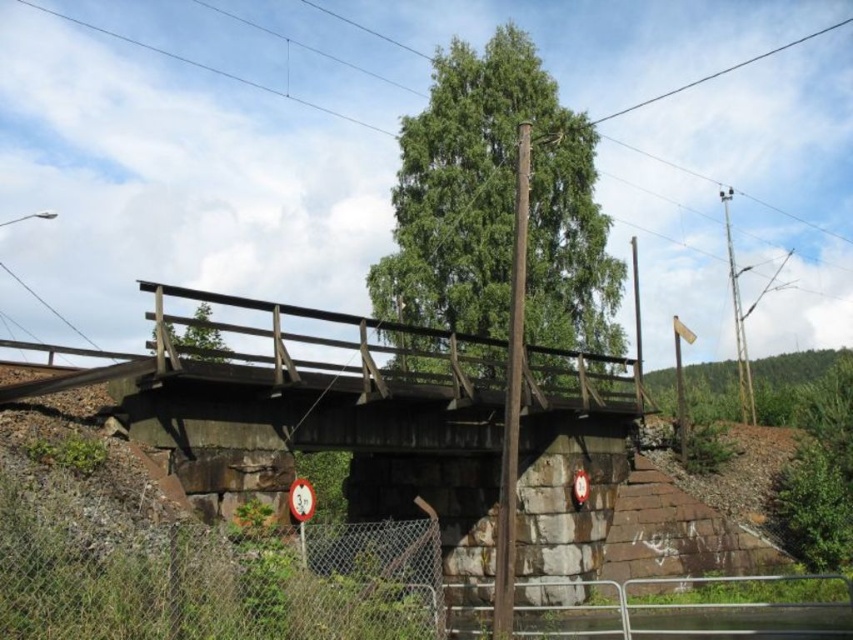
Is green matte tree at center taller than black wire at upper center?

Incorrect, green matte tree at center's height is not larger of black wire at upper center's.

Can you confirm if green matte tree at center is wider than black wire at upper center?

Incorrect, green matte tree at center's width does not surpass black wire at upper center's.

Locate an element on the screen. This screenshot has height=640, width=853. green matte tree at center is located at coordinates (196, 340).

Locate an element on the screen. green matte tree at center is located at coordinates (196, 340).

Can you confirm if green leafy tree at center is positioned above black wire at upper center?

A: No.

Is green leafy tree at center smaller than black wire at upper center?

No.

At what (x,y) coordinates should I click in order to perform the action: click on green leafy tree at center. Please return your answer as a coordinate pair (x, y). The height and width of the screenshot is (640, 853). Looking at the image, I should click on (498, 205).

Who is positioned more to the left, green leafy tree at center or green matte tree at center?

Positioned to the left is green matte tree at center.

Measure the distance between point (372, 291) and camera.

Point (372, 291) and camera are 56.31 meters apart.

Where is `green leafy tree at center`? Image resolution: width=853 pixels, height=640 pixels. green leafy tree at center is located at coordinates (498, 205).